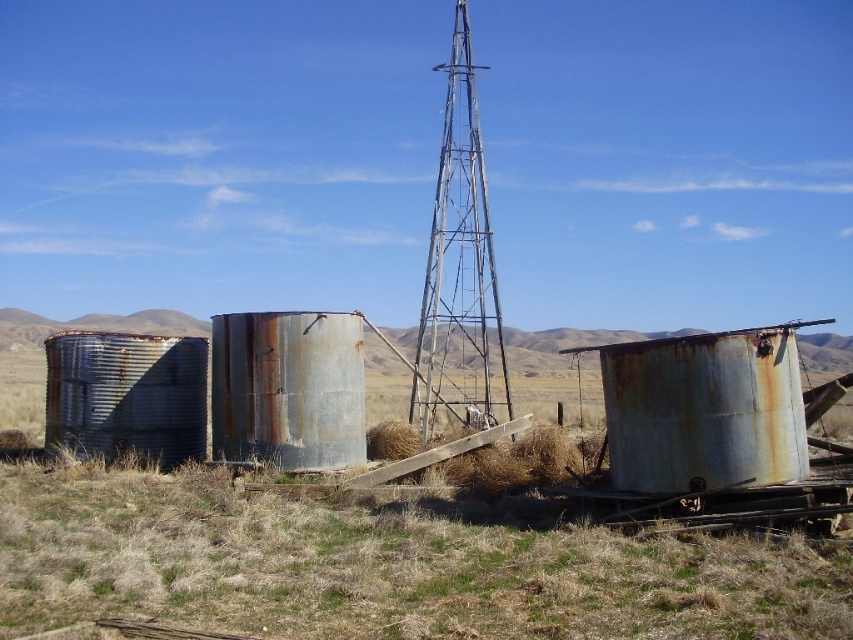
You are a surveyor standing at the origin point of the coordinate system. You need to locate the rusty metal water tower at center. What are its coordinates?

The coordinates of the rusty metal water tower at center are at point (459,268).

You are standing at the point with coordinates point (241, 385) and want to walk to the point with coordinates point (479, 388). Will the tall metal structure block your path?

Point (479, 388) is behind point (241, 385), so the tall metal structure will block your path to point (479, 388).